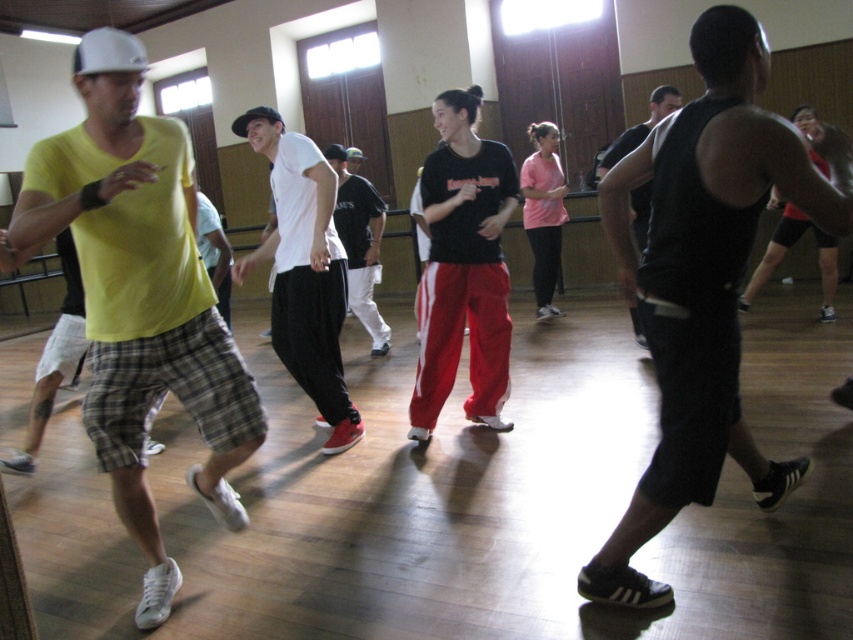
Question: Which point is farther from the camera taking this photo?

Choices:
 (A) (627, 154)
 (B) (196, 422)
 (C) (367, 221)

Answer: (C)

Question: In this image, where is black sleeveless shirt at center located relative to black matte tank top at center?

Choices:
 (A) right
 (B) left

Answer: (B)

Question: Where is black sleeveless shirt at center located in relation to black cotton shirt at center in the image?

Choices:
 (A) left
 (B) right

Answer: (B)

Question: Which object is farther from the camera taking this photo?

Choices:
 (A) black matte tank top at center
 (B) white matte t-shirt at center

Answer: (A)

Question: Which object is closer to the camera taking this photo?

Choices:
 (A) black sleeveless shirt at center
 (B) white matte t-shirt at center
 (C) black cotton shirt at center
 (D) black matte tank top at center

Answer: (A)

Question: Does black sleeveless shirt at center lie behind yellow matte t-shirt at left?

Choices:
 (A) no
 (B) yes

Answer: (B)